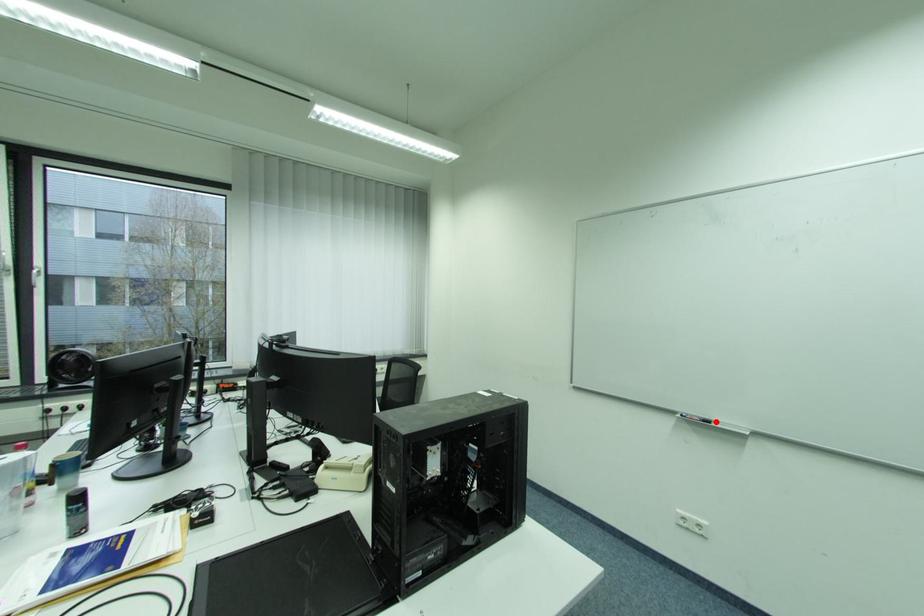
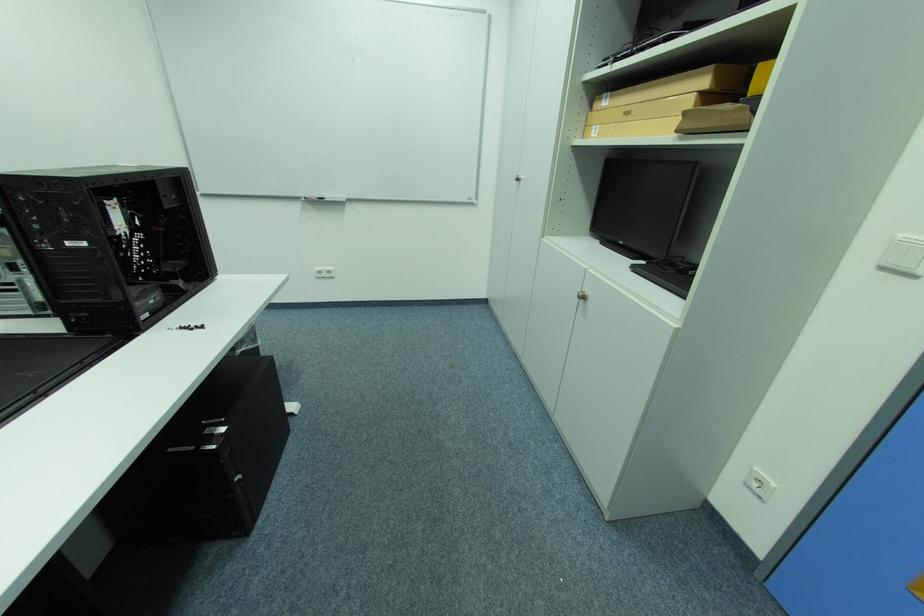
Find the pixel in the second image that matches the highlighted location in the first image.

(331, 199)